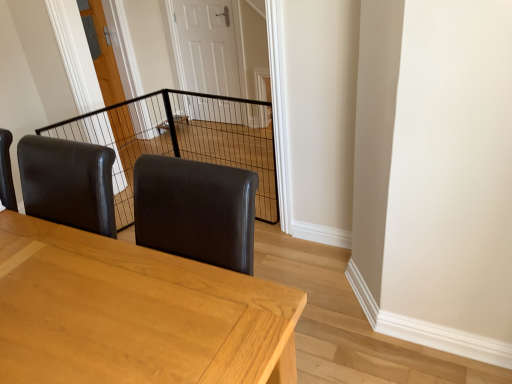
Question: From a real-world perspective, is black wire mesh at center physically located above or below white glossy door at center, the first door positioned from the right?

Choices:
 (A) below
 (B) above

Answer: (A)

Question: In the image, is black wire mesh at center on the left side or the right side of white glossy door at center, the first door positioned from the right?

Choices:
 (A) right
 (B) left

Answer: (B)

Question: Which object is the farthest from the white glossy door at center, the first door positioned from the right?

Choices:
 (A) black wire mesh at center
 (B) light brown wooden table at center
 (C) wooden door at center, the first door positioned from the left

Answer: (B)

Question: Which object is the closest to the black wire mesh at center?

Choices:
 (A) wooden door at center, the second door from the right
 (B) light brown wooden table at center
 (C) white glossy door at center, which appears as the second door when viewed from the left

Answer: (C)